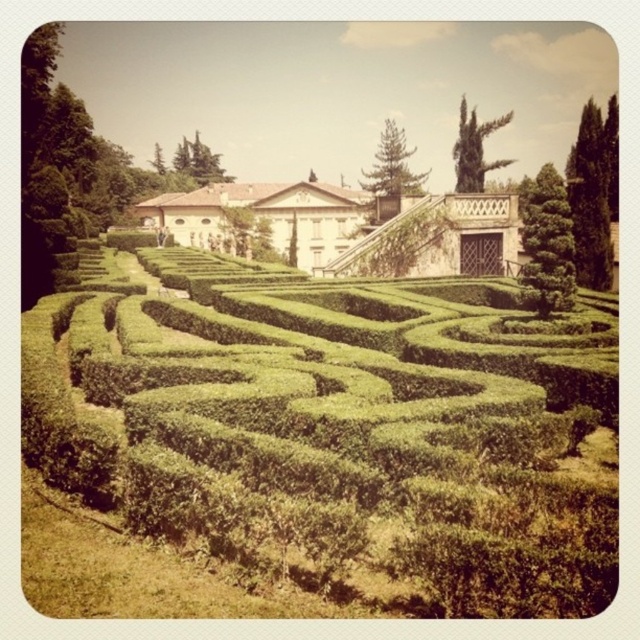
You are a gardener who needs to water both the green hedge maze at center and the white stone palace at center. Which object should you approach first if you are standing at the entrance of the garden on the left side?

Since the green hedge maze at center is to the right of the white stone palace at center, you should approach the white stone palace at center first as it is closer to your starting position on the left side.

You are a gardener planning to install a new irrigation system in the garden. You need to run a hose from the water source located at the base of the white stone palace at center to the green leafy bush at right. Based on their positions, will the hose need to go uphill or downhill?

The white stone palace at center is below the green leafy bush at right, so the hose will need to go uphill from the palace to the bush.